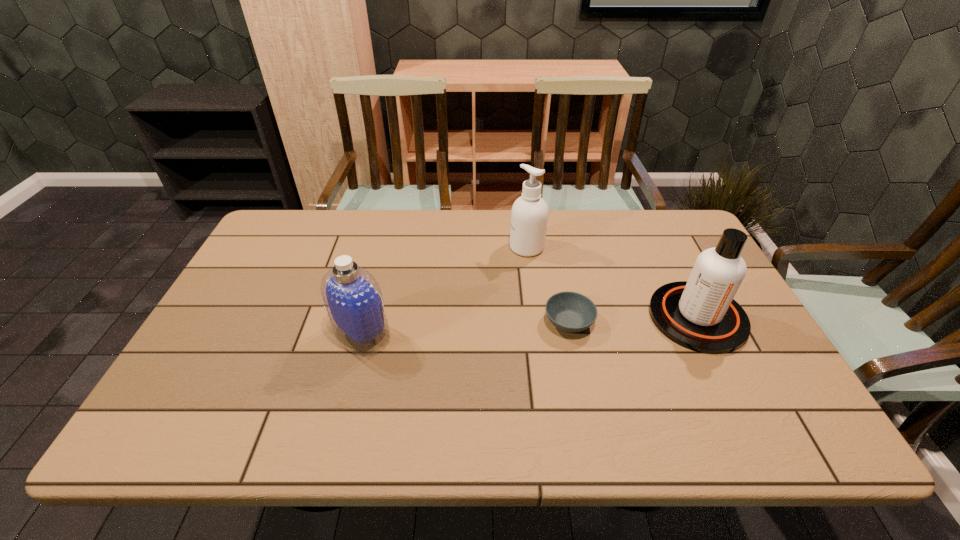
Locate which cleansing agent ranks in proximity to the farthest object. Please provide its 2D coordinates. Your answer should be formatted as a tuple, i.e. [(x, y)], where the tuple contains the x and y coordinates of a point satisfying the conditions above.

[(700, 314)]

Find the location of a particular element. Image resolution: width=960 pixels, height=540 pixels. vacant space that satisfies the following two spatial constraints: 1. on the back side of the rightmost object; 2. on the front label of the second cleansing agent from right to left is located at coordinates (662, 247).

Where is `vacant area in the image that satisfies the following two spatial constraints: 1. on the front label of the soup bowl; 2. on the right side of the farthest object`? vacant area in the image that satisfies the following two spatial constraints: 1. on the front label of the soup bowl; 2. on the right side of the farthest object is located at coordinates (537, 322).

I want to click on free point that satisfies the following two spatial constraints: 1. on the front label of the farthest object; 2. on the left side of the rightmost cleansing agent, so click(x=536, y=317).

Where is `free space that satisfies the following two spatial constraints: 1. on the back side of the soup bowl; 2. on the front label of the farthest object`? Image resolution: width=960 pixels, height=540 pixels. free space that satisfies the following two spatial constraints: 1. on the back side of the soup bowl; 2. on the front label of the farthest object is located at coordinates (554, 247).

I want to click on free spot that satisfies the following two spatial constraints: 1. on the front label of the shortest object; 2. on the left side of the second cleansing agent from right to left, so click(x=537, y=322).

Image resolution: width=960 pixels, height=540 pixels. Find the location of `free location that satisfies the following two spatial constraints: 1. on the front label of the soup bowl; 2. on the left side of the second cleansing agent from left to right`. free location that satisfies the following two spatial constraints: 1. on the front label of the soup bowl; 2. on the left side of the second cleansing agent from left to right is located at coordinates (537, 322).

The image size is (960, 540). Find the location of `free space that satisfies the following two spatial constraints: 1. on the front label of the farthest cleansing agent; 2. on the left side of the rightmost object`. free space that satisfies the following two spatial constraints: 1. on the front label of the farthest cleansing agent; 2. on the left side of the rightmost object is located at coordinates (536, 317).